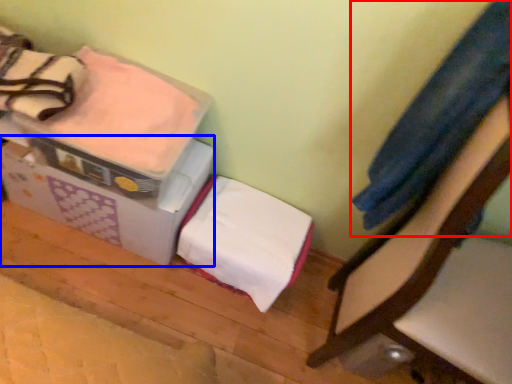
Question: Which point is further to the camera, clothing (highlighted by a red box) or cardboard box (highlighted by a blue box)?

Choices:
 (A) clothing
 (B) cardboard box

Answer: (B)